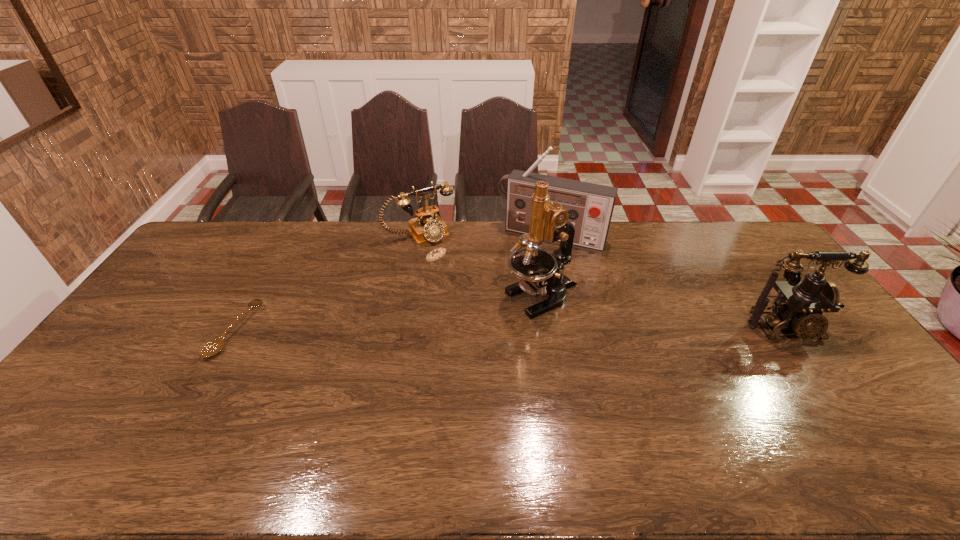
Locate an element on the screen. Image resolution: width=960 pixels, height=540 pixels. free space on the desktop that is between the leftmost object and the third shortest object and is positioned on the front panel of the radio receiver is located at coordinates (509, 329).

Where is `free space on the desktop that is between the shortest object and the nearer telephone and is positioned on the dial number of the fourth tallest object`? The width and height of the screenshot is (960, 540). free space on the desktop that is between the shortest object and the nearer telephone and is positioned on the dial number of the fourth tallest object is located at coordinates coord(490,329).

You are a GUI agent. You are given a task and a screenshot of the screen. Output one action in this format:
    pyautogui.click(x=<x>, y=<y>)
    Task: Click on the free spot on the desktop that is between the ladle and the rightmost object and is positioned at the eyepiece of the tallest object
    This screenshot has width=960, height=540.
    Given the screenshot: What is the action you would take?
    pyautogui.click(x=469, y=330)